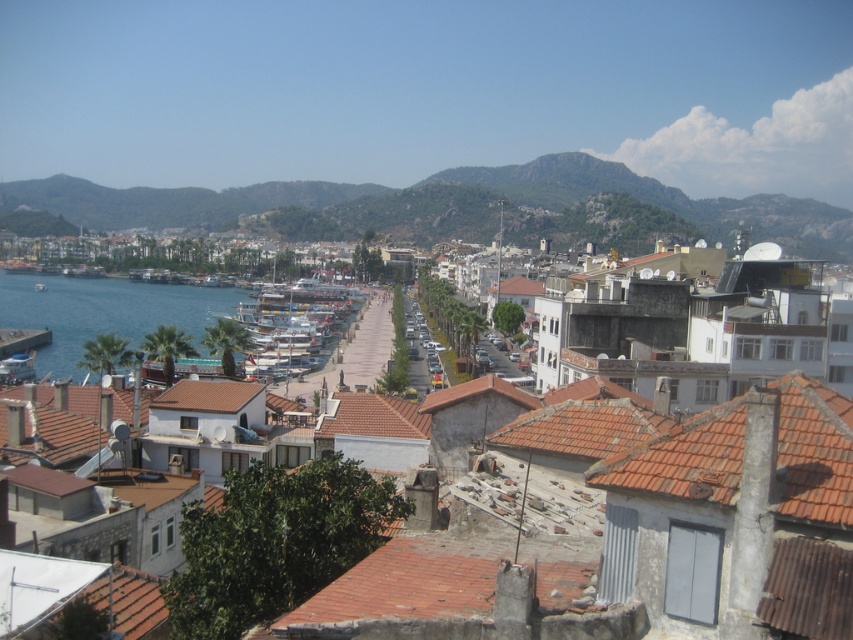
Question: Is brown tiled roofs at center positioned behind green leafy hillside at upper center?

Choices:
 (A) yes
 (B) no

Answer: (B)

Question: Among these objects, which one is nearest to the camera?

Choices:
 (A) green leafy hillside at upper center
 (B) brown tiled roofs at center
 (C) blue water at lower left

Answer: (B)

Question: Does green leafy hillside at upper center have a smaller size compared to white glossy boat at center?

Choices:
 (A) no
 (B) yes

Answer: (A)

Question: Which object is the farthest from the blue water at lower left?

Choices:
 (A) brown tiled roofs at center
 (B) white glossy boat at center

Answer: (A)

Question: Which object is closer to the camera taking this photo?

Choices:
 (A) green leafy hillside at upper center
 (B) white glossy boat at center

Answer: (B)

Question: Is brown tiled roofs at center smaller than white glossy boat at center?

Choices:
 (A) yes
 (B) no

Answer: (A)